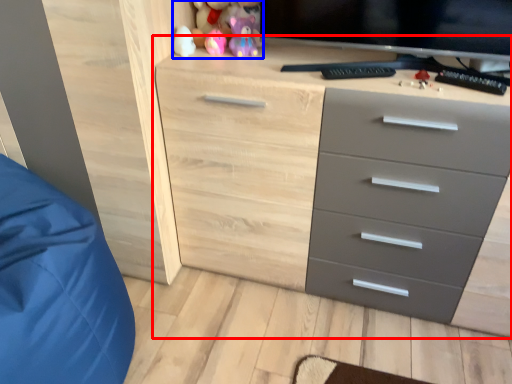
Question: Which of the following is the closest to the observer, chest of drawers (highlighted by a red box) or toy (highlighted by a blue box)?

Choices:
 (A) chest of drawers
 (B) toy

Answer: (A)